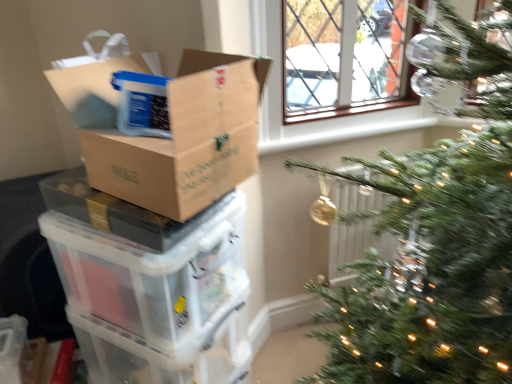
The width and height of the screenshot is (512, 384). What do you see at coordinates (187, 139) in the screenshot? I see `brown cardboard box at left` at bounding box center [187, 139].

Where is `white plastic radiator at center-right`? This screenshot has height=384, width=512. white plastic radiator at center-right is located at coordinates (354, 246).

The width and height of the screenshot is (512, 384). In order to click on translucent plastic storage box at left in this screenshot , I will do `click(152, 277)`.

From the image's perspective, would you say transparent plastic storage box at lower left is positioned over brown cardboard box at left?

Actually, transparent plastic storage box at lower left appears below brown cardboard box at left in the image.

Which object is positioned more to the left, transparent plastic storage box at lower left or brown cardboard box at left?

transparent plastic storage box at lower left.

Could you tell me if transparent plastic storage box at lower left is turned towards brown cardboard box at left?

No, transparent plastic storage box at lower left is not aimed at brown cardboard box at left.

Looking at this image, considering the positions of objects transparent plastic storage box at lower left and brown cardboard box at left in the image provided, who is behind, transparent plastic storage box at lower left or brown cardboard box at left?

transparent plastic storage box at lower left is further from the camera.

Is point (241, 216) closer to camera compared to point (191, 306)?

No, it is behind (191, 306).

Is translucent plastic storage box at left at the left side of transparent plastic storage box at lower left?

Yes, translucent plastic storage box at left is to the left of transparent plastic storage box at lower left.

Does translucent plastic storage box at left turn towards transparent plastic storage box at lower left?

No, translucent plastic storage box at left does not turn towards transparent plastic storage box at lower left.

Which of these two, translucent plastic storage box at left or brown cardboard box at left, is smaller?

brown cardboard box at left is smaller.

I want to click on storage box behind the brown cardboard box at left, so click(x=152, y=277).

Is translucent plastic storage box at left next to brown cardboard box at left?

No.

Is the depth of translucent plastic storage box at left greater than that of brown cardboard box at left?

Yes, the depth of translucent plastic storage box at left is greater than that of brown cardboard box at left.

Is transparent plastic storage box at lower left not within white plastic radiator at center-right?

Yes.

From the image's perspective, is transparent plastic storage box at lower left above or below white plastic radiator at center-right?

Clearly, from the image's perspective, transparent plastic storage box at lower left is below white plastic radiator at center-right.

Considering the relative positions of transparent plastic storage box at lower left and white plastic radiator at center-right in the image provided, is transparent plastic storage box at lower left to the right of white plastic radiator at center-right from the viewer's perspective?

Incorrect, transparent plastic storage box at lower left is not on the right side of white plastic radiator at center-right.

From the image's perspective, is transparent plastic storage box at lower left located beneath translucent plastic storage box at left?

Yes, from the image's perspective, transparent plastic storage box at lower left is below translucent plastic storage box at left.

Consider the image. Does transparent plastic storage box at lower left turn towards translucent plastic storage box at left?

No, transparent plastic storage box at lower left is not facing towards translucent plastic storage box at left.

Is point (88, 347) closer or farther from the camera than point (186, 307)?

Point (88, 347).

Is white plastic radiator at center-right touching transparent plastic storage box at lower left?

No, white plastic radiator at center-right is not in contact with transparent plastic storage box at lower left.

Can you confirm if white plastic radiator at center-right is bigger than transparent plastic storage box at lower left?

No.

Between point (345, 190) and point (126, 331), which one is positioned behind?

The point (345, 190) is farther from the camera.

From the image's perspective, is white plastic radiator at center-right located above or below transparent plastic storage box at lower left?

From the image's perspective, white plastic radiator at center-right appears above transparent plastic storage box at lower left.

Is white plastic radiator at center-right at the back of brown cardboard box at left?

brown cardboard box at left is not turned away from white plastic radiator at center-right.

Is there a large distance between brown cardboard box at left and white plastic radiator at center-right?

No.

Between brown cardboard box at left and white plastic radiator at center-right, which one has less height?

brown cardboard box at left.

From the image's perspective, between brown cardboard box at left and white plastic radiator at center-right, who is located below?

white plastic radiator at center-right is shown below in the image.

Where is `glass box that appears behind the brown cardboard box at left`? Image resolution: width=512 pixels, height=384 pixels. glass box that appears behind the brown cardboard box at left is located at coordinates (167, 347).

This screenshot has height=384, width=512. Identify the location of storage box above the transparent plastic storage box at lower left (from the image's perspective). (152, 277).

Based on the photo, from the image, which object appears to be nearer to white plastic radiator at center-right, transparent plastic storage box at lower left or translucent plastic storage box at left?

transparent plastic storage box at lower left lies closer to white plastic radiator at center-right than the other object.

Which object lies further to the anchor point translucent plastic storage box at left, transparent plastic storage box at lower left or brown cardboard box at left?

Based on the image, brown cardboard box at left appears to be further to translucent plastic storage box at left.

Looking at the image, which one is located closer to brown cardboard box at left, transparent plastic storage box at lower left or white plastic radiator at center-right?

Based on the image, transparent plastic storage box at lower left appears to be nearer to brown cardboard box at left.

Which object lies nearer to the anchor point transparent plastic storage box at lower left, translucent plastic storage box at left or white plastic radiator at center-right?

translucent plastic storage box at left lies closer to transparent plastic storage box at lower left than the other object.

When comparing their distances from translucent plastic storage box at left, does brown cardboard box at left or transparent plastic storage box at lower left seem closer?

A: transparent plastic storage box at lower left lies closer to translucent plastic storage box at left than the other object.

From the image, which object appears to be nearer to transparent plastic storage box at lower left, brown cardboard box at left or translucent plastic storage box at left?

translucent plastic storage box at left is positioned closer to the anchor transparent plastic storage box at lower left.

Based on their spatial positions, is translucent plastic storage box at left or transparent plastic storage box at lower left further from white plastic radiator at center-right?

Based on the image, translucent plastic storage box at left appears to be further to white plastic radiator at center-right.

Which object lies nearer to the anchor point translucent plastic storage box at left, white plastic radiator at center-right or brown cardboard box at left?

The object closer to translucent plastic storage box at left is brown cardboard box at left.

Locate an element on the screen. cardboard box between transparent plastic storage box at lower left and white plastic radiator at center-right in the horizontal direction is located at coordinates (187, 139).

You are a GUI agent. You are given a task and a screenshot of the screen. Output one action in this format:
    pyautogui.click(x=<x>, y=<y>)
    Task: Click on the storage box between brown cardboard box at left and transparent plastic storage box at lower left vertically
    This screenshot has width=512, height=384.
    Given the screenshot: What is the action you would take?
    point(152,277)

You are a GUI agent. You are given a task and a screenshot of the screen. Output one action in this format:
    pyautogui.click(x=<x>, y=<y>)
    Task: Click on the glass box between translucent plastic storage box at left and white plastic radiator at center-right in the horizontal direction
    The image size is (512, 384).
    Given the screenshot: What is the action you would take?
    pyautogui.click(x=167, y=347)

Locate an element on the screen. Image resolution: width=512 pixels, height=384 pixels. cardboard box situated between translucent plastic storage box at left and white plastic radiator at center-right from left to right is located at coordinates (187, 139).